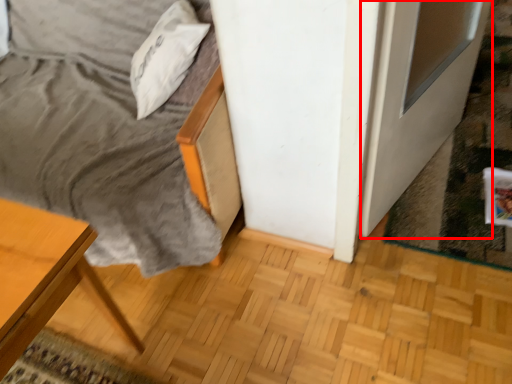
Question: Where is screen door (annotated by the red box) located in relation to pillow in the image?

Choices:
 (A) right
 (B) left

Answer: (A)